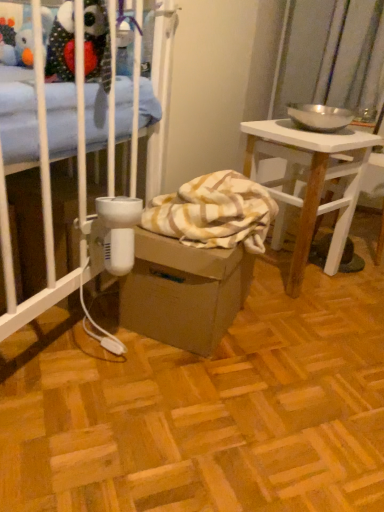
Locate an element on the screen. The image size is (384, 512). vacant area that lies to the right of white wood desk at right is located at coordinates (359, 285).